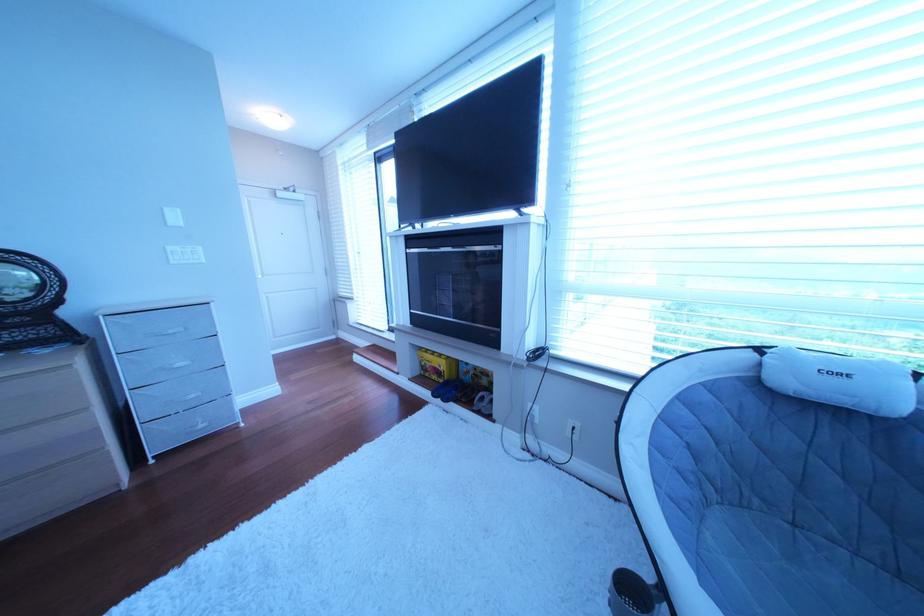
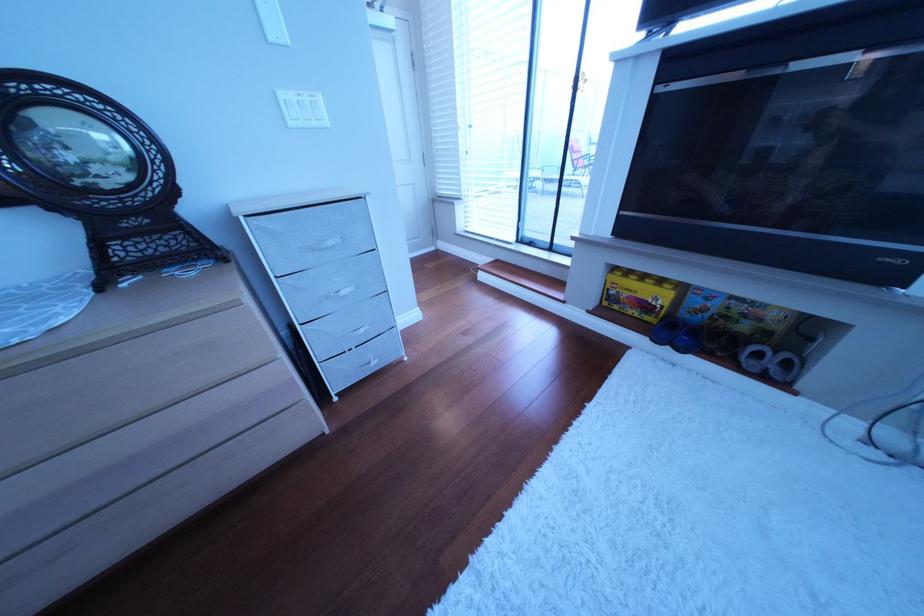
Find the pixel in the second image that matches (x=444, y=367) in the first image.

(640, 296)